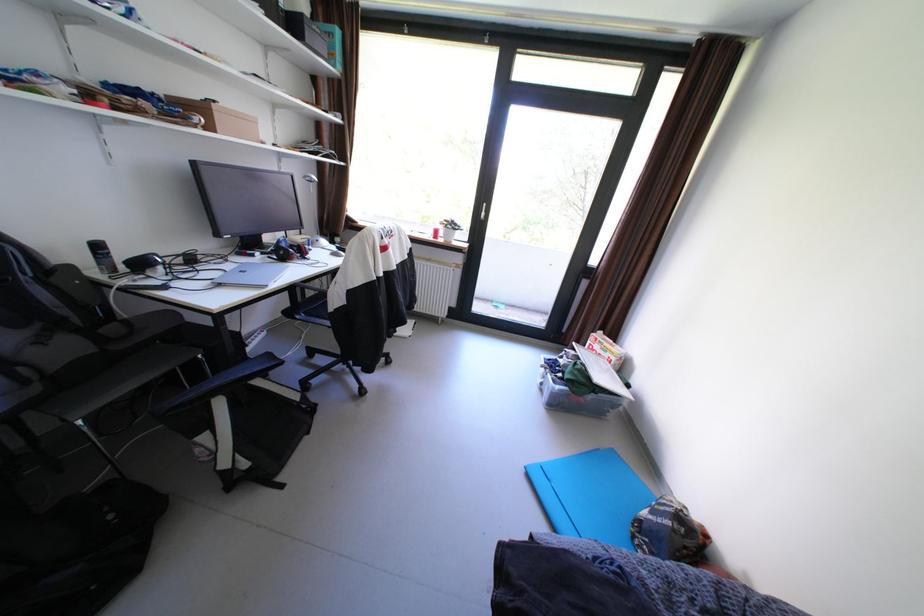
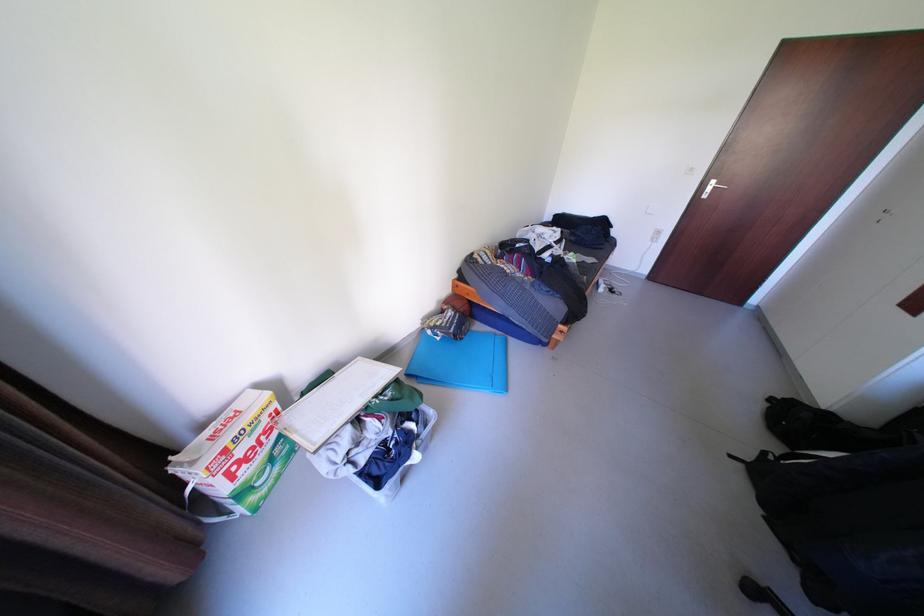
In the second image, find the point that corresponds to point (572, 361) in the first image.

(372, 459)